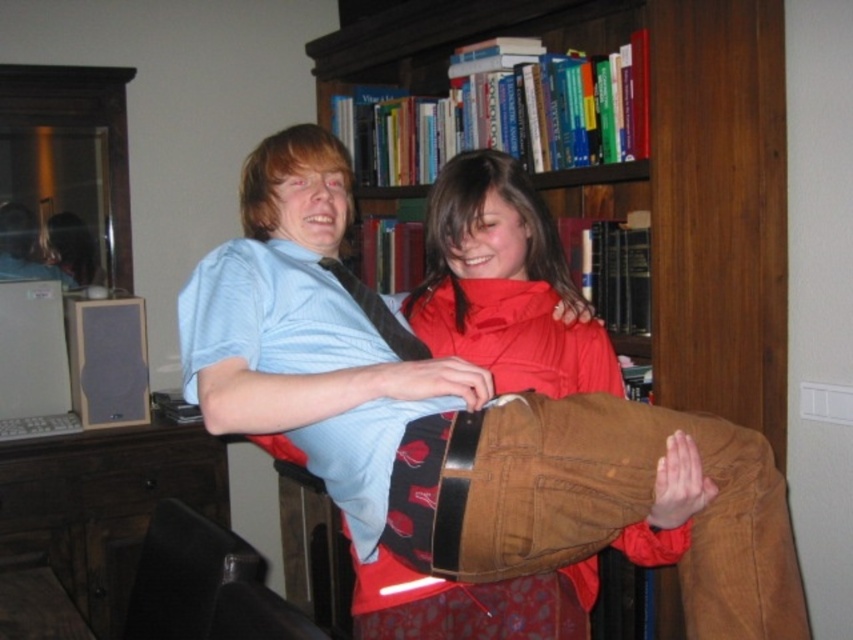
Question: Which of the following is the closest to the observer?

Choices:
 (A) corduroy pants at center
 (B) wooden bookshelf at upper center

Answer: (A)

Question: Which of the following is the closest to the observer?

Choices:
 (A) (477, 340)
 (B) (775, 429)

Answer: (A)

Question: Is wooden bookshelf at upper center below corduroy pants at center?

Choices:
 (A) no
 (B) yes

Answer: (A)

Question: Can you confirm if wooden bookshelf at upper center is thinner than corduroy pants at center?

Choices:
 (A) no
 (B) yes

Answer: (A)

Question: Can you confirm if wooden bookshelf at upper center is thinner than corduroy pants at center?

Choices:
 (A) no
 (B) yes

Answer: (A)